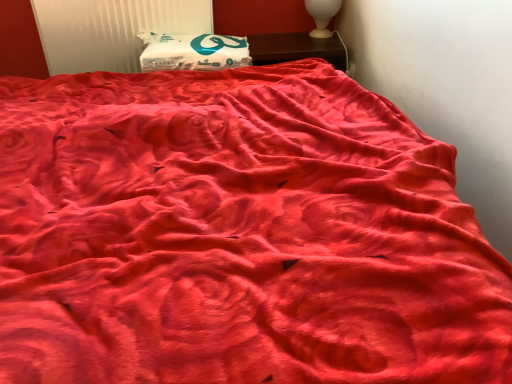
Question: From a real-world perspective, is white plastic radiator at upper left physically located above or below white matte pillow at upper center?

Choices:
 (A) below
 (B) above

Answer: (B)

Question: Choose the correct answer: Is white plastic radiator at upper left inside white matte pillow at upper center or outside it?

Choices:
 (A) inside
 (B) outside

Answer: (B)

Question: Estimate the real-world distances between objects in this image. Which object is farther from the white plastic radiator at upper left?

Choices:
 (A) wooden nightstand at upper center
 (B) white glossy table lamp at upper right
 (C) white matte pillow at upper center

Answer: (B)

Question: Which object is the closest to the wooden nightstand at upper center?

Choices:
 (A) white plastic radiator at upper left
 (B) white glossy table lamp at upper right
 (C) white matte pillow at upper center

Answer: (B)